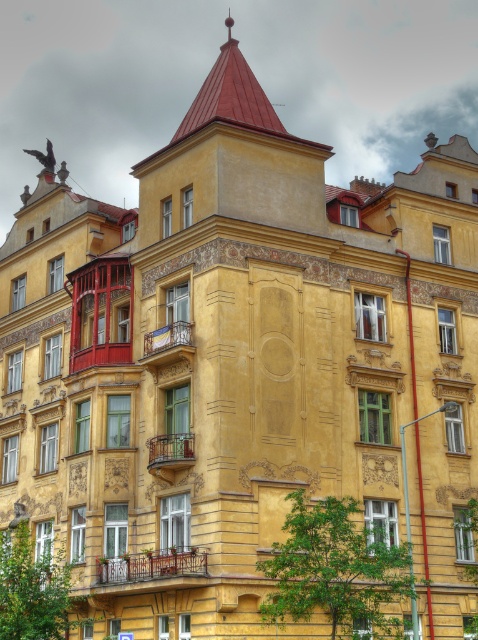
You are an architect assessing the building for safety. You notice the rustic wooden balcony at lower center and the metallic wrought iron balcony at upper center. Which balcony is closer to the ground?

The rustic wooden balcony at lower center is closer to the ground because it has a lesser height compared to the metallic wrought iron balcony at upper center.

You are a painter standing on the ground floor of the building. You need to paint the spire of the red pointed turret. Which balcony, the rustic wooden balcony at lower center or the metallic wrought iron balcony at center, would you use as a platform to reach the spire?

The metallic wrought iron balcony at center is taller than the rustic wooden balcony at lower center, so you should use the metallic wrought iron balcony at center to reach the spire.

You are standing in front of the residential building and want to hang a small flower basket. You see the metallic wrought iron balcony at upper center and the metallic wrought iron balcony at center. Which balcony is located to the left when viewed from the front?

The metallic wrought iron balcony at upper center is positioned on the left side of the metallic wrought iron balcony at center, so it is the one located to the left when viewed from the front.